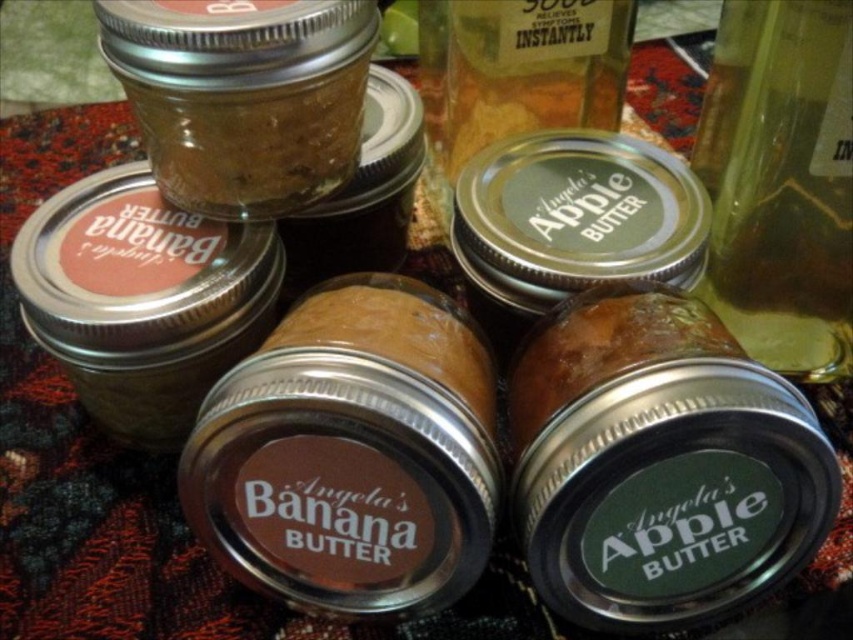
Question: Which point is closer to the camera?

Choices:
 (A) matte silver jar at upper left
 (B) transparent glass bottle at center-right
 (C) matte glass jar at upper left

Answer: (B)

Question: Can you confirm if transparent glass bottle at center-right is positioned below matte glass jar at upper left?

Choices:
 (A) no
 (B) yes

Answer: (B)

Question: Can you confirm if transparent glass bottle at center-right is positioned below matte silver jar at upper left?

Choices:
 (A) no
 (B) yes

Answer: (A)

Question: In this image, where is transparent glass bottle at center-right located relative to matte silver jar at upper left?

Choices:
 (A) right
 (B) left

Answer: (A)

Question: Based on their relative distances, which object is farther from the transparent glass bottle at center-right?

Choices:
 (A) matte glass jar at upper left
 (B) matte silver jar at upper left

Answer: (B)

Question: Which of these objects is positioned farthest from the matte glass jar at upper left?

Choices:
 (A) matte silver jar at upper left
 (B) transparent glass bottle at center-right

Answer: (B)